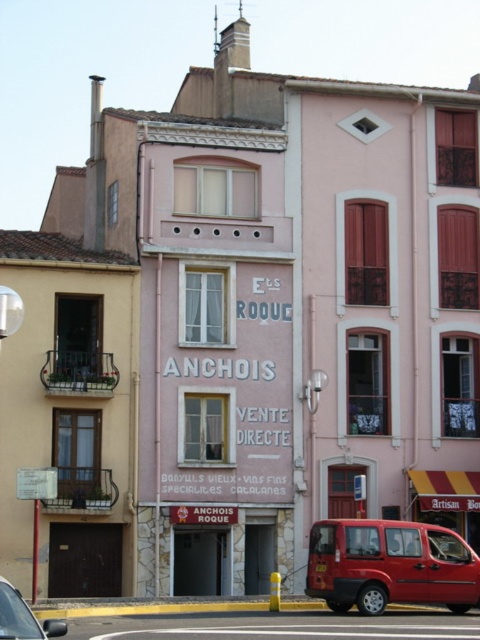
Can you confirm if metallic red van at lower center is shorter than metallic silver car at lower left?

Correct, metallic red van at lower center is not as tall as metallic silver car at lower left.

Is metallic red van at lower center taller than metallic silver car at lower left?

Incorrect, metallic red van at lower center's height is not larger of metallic silver car at lower left's.

Find the location of a particular element. metallic red van at lower center is located at coordinates (389, 564).

Locate an element on the screen. This screenshot has height=640, width=480. metallic red van at lower center is located at coordinates (389, 564).